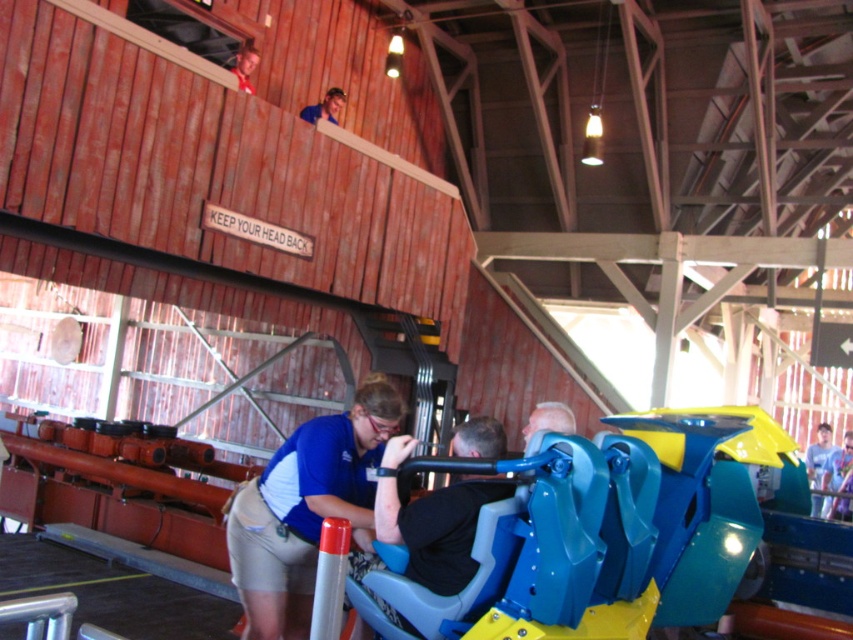
In the scene shown: You are designing a new uniform for the amusement park staff. You have two blue shirts available. The blue fabric shirt at center and the blue shirt at upper center. Which one should you choose if you want a wider uniform for better visibility?

The blue fabric shirt at center should be chosen because its width is larger than the blue shirt at upper center, making it more visible.

Consider the image. You are a safety inspector checking the roller coaster car. You notice two people near the car. One is wearing a light blue shirt at center and the other a blue shirt at upper center. Which person is closer to the safety sign hanging from the upper level?

The blue shirt at upper center is closer to the safety sign hanging from the upper level because they are positioned near the upper area where the sign is located.

You are standing at the roller coaster station and want to locate two specific points in the image. The first point is at coordinates point (821, 454) and the second is at point (334, 115). Which of these two points is closer to you?

Point (821, 454) is closer to you because it is further to the viewer than point (334, 115).